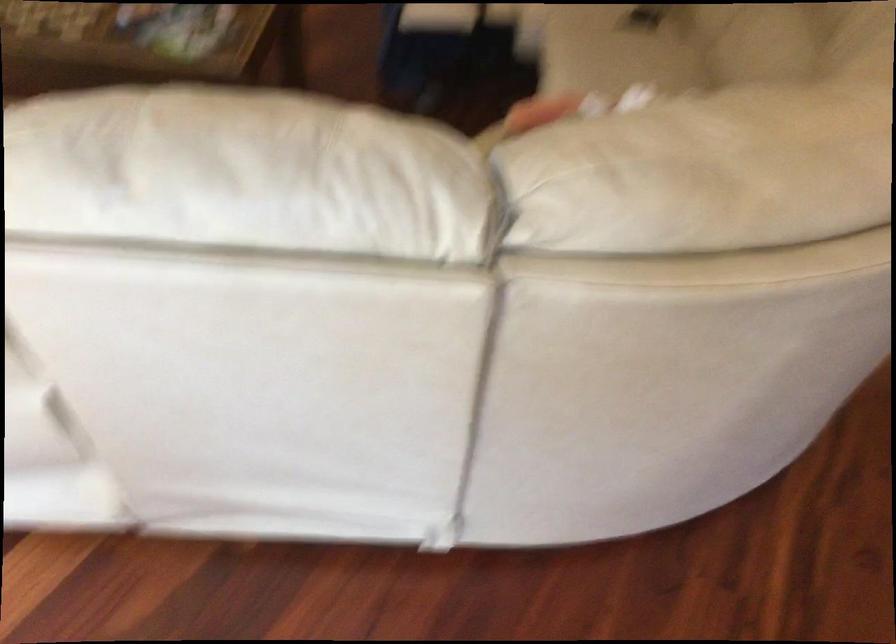
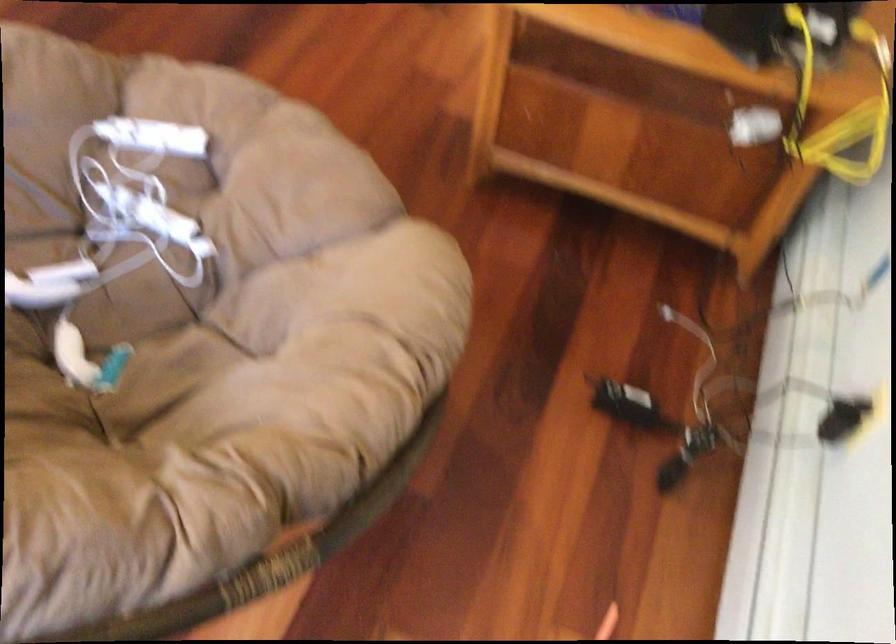
The images are taken continuously from a first-person perspective. In which direction are you moving?

The cameraman walked toward right, backward.